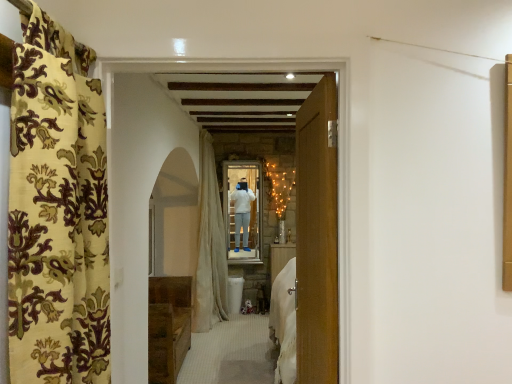
I want to click on white sheer curtain at center, marked as the second curtain in a front-to-back arrangement, so click(x=209, y=246).

You are a GUI agent. You are given a task and a screenshot of the screen. Output one action in this format:
    pyautogui.click(x=<x>, y=<y>)
    Task: Click on the white sheer curtain at center, the first curtain in the back-to-front sequence
    This screenshot has height=384, width=512.
    Given the screenshot: What is the action you would take?
    pyautogui.click(x=209, y=246)

Between velvet floral curtain at left, which ranks as the 1th curtain in front-to-back order, and white sheer curtain at center, marked as the second curtain in a front-to-back arrangement, which one has larger width?

white sheer curtain at center, marked as the second curtain in a front-to-back arrangement, is wider.

From the image's perspective, between velvet floral curtain at left, the second curtain viewed from the back, and white sheer curtain at center, marked as the second curtain in a front-to-back arrangement, which one is located above?

velvet floral curtain at left, the second curtain viewed from the back.

Which of these two, velvet floral curtain at left, which ranks as the 1th curtain in front-to-back order, or white sheer curtain at center, marked as the second curtain in a front-to-back arrangement, stands taller?

white sheer curtain at center, marked as the second curtain in a front-to-back arrangement.

Looking at this image, is velvet floral curtain at left, which ranks as the 1th curtain in front-to-back order, with white sheer curtain at center, the first curtain in the back-to-front sequence?

No, velvet floral curtain at left, which ranks as the 1th curtain in front-to-back order, is not making contact with white sheer curtain at center, the first curtain in the back-to-front sequence.

Considering the sizes of objects brown wooden chest at lower left and wooden door at center in the image provided, who is shorter, brown wooden chest at lower left or wooden door at center?

With less height is brown wooden chest at lower left.

Looking at the image, does brown wooden chest at lower left seem bigger or smaller compared to wooden door at center?

brown wooden chest at lower left is bigger than wooden door at center.

From the image's perspective, who appears lower, brown wooden chest at lower left or wooden door at center?

brown wooden chest at lower left, from the image's perspective.

How many degrees apart are the facing directions of wooden door at center and brown wooden chest at lower left?

87.3 degrees separate the facing orientations of wooden door at center and brown wooden chest at lower left.

Is wooden door at center further to camera compared to brown wooden chest at lower left?

No, wooden door at center is closer to the viewer.

Is wooden door at center to the left of brown wooden chest at lower left from the viewer's perspective?

Incorrect, wooden door at center is not on the left side of brown wooden chest at lower left.

From the image's perspective, relative to brown wooden chest at lower left, is wooden door at center above or below?

wooden door at center is situated higher than brown wooden chest at lower left in the image.

Could you measure the distance between white sheer curtain at center, marked as the second curtain in a front-to-back arrangement, and brown wooden chest at lower left?

They are 30.35 inches apart.

From the picture: Considering the relative positions of white sheer curtain at center, the first curtain in the back-to-front sequence, and brown wooden chest at lower left in the image provided, is white sheer curtain at center, the first curtain in the back-to-front sequence, to the right of brown wooden chest at lower left from the viewer's perspective?

Correct, you'll find white sheer curtain at center, the first curtain in the back-to-front sequence, to the right of brown wooden chest at lower left.

From a real-world perspective, which object rests below the other?

brown wooden chest at lower left, from a real-world perspective.

From the image's perspective, would you say white sheer curtain at center, the first curtain in the back-to-front sequence, is positioned over brown wooden chest at lower left?

Yes, from the image's perspective, white sheer curtain at center, the first curtain in the back-to-front sequence, is over brown wooden chest at lower left.

Is white sheer curtain at center, the first curtain in the back-to-front sequence, inside or outside of wooden door at center?

white sheer curtain at center, the first curtain in the back-to-front sequence, is not enclosed by wooden door at center.

Considering the relative sizes of white sheer curtain at center, the first curtain in the back-to-front sequence, and wooden door at center in the image provided, is white sheer curtain at center, the first curtain in the back-to-front sequence, bigger than wooden door at center?

Yes.

Is white sheer curtain at center, marked as the second curtain in a front-to-back arrangement, next to wooden door at center and touching it?

No, white sheer curtain at center, marked as the second curtain in a front-to-back arrangement, is not with wooden door at center.

Does point (203, 216) come farther from viewer compared to point (122, 247)?

That is True.

From the image's perspective, which one is positioned higher, velvet floral curtain at left, which ranks as the 1th curtain in front-to-back order, or wooden door at center?

From the image's view, wooden door at center is above.

Which is more to the left, velvet floral curtain at left, the second curtain viewed from the back, or wooden door at center?

Positioned to the left is velvet floral curtain at left, the second curtain viewed from the back.

Between velvet floral curtain at left, the second curtain viewed from the back, and wooden door at center, which one has larger size?

With larger size is wooden door at center.

From the picture: Can you tell me how much velvet floral curtain at left, which ranks as the 1th curtain in front-to-back order, and wooden door at center differ in facing direction?

They differ by 91.7 degrees in their facing directions.

Is wooden door at center facing away from velvet floral curtain at left, which ranks as the 1th curtain in front-to-back order?

Correct, wooden door at center is looking away from velvet floral curtain at left, which ranks as the 1th curtain in front-to-back order.

Does wooden door at center have a greater width compared to velvet floral curtain at left, the second curtain viewed from the back?

No, wooden door at center is not wider than velvet floral curtain at left, the second curtain viewed from the back.

Is wooden door at center far away from velvet floral curtain at left, the second curtain viewed from the back?

That's not correct — wooden door at center is a little close to velvet floral curtain at left, the second curtain viewed from the back.

Where is `curtain above the white sheer curtain at center, marked as the second curtain in a front-to-back arrangement (from the image's perspective)`? The height and width of the screenshot is (384, 512). curtain above the white sheer curtain at center, marked as the second curtain in a front-to-back arrangement (from the image's perspective) is located at coordinates (57, 211).

The image size is (512, 384). There is a brown wooden chest at lower left. Identify the location of hotel lobby above it (from a real-world perspective). (167, 178).

When comparing their distances from white sheer curtain at center, the first curtain in the back-to-front sequence, does velvet floral curtain at left, the second curtain viewed from the back, or brown wooden chest at lower left seem closer?

brown wooden chest at lower left is closer to white sheer curtain at center, the first curtain in the back-to-front sequence.

In the scene shown: When comparing their distances from brown wooden chest at lower left, does wooden door at center or white sheer curtain at center, marked as the second curtain in a front-to-back arrangement, seem further?

wooden door at center.

Based on their spatial positions, is brown wooden chest at lower left or velvet floral curtain at left, the second curtain viewed from the back, closer to wooden door at center?

velvet floral curtain at left, the second curtain viewed from the back, lies closer to wooden door at center than the other object.

Based on their spatial positions, is wooden door at center or velvet floral curtain at left, which ranks as the 1th curtain in front-to-back order, further from brown wooden chest at lower left?

The object further to brown wooden chest at lower left is velvet floral curtain at left, which ranks as the 1th curtain in front-to-back order.

Looking at this image, which object lies further to the anchor point white sheer curtain at center, the first curtain in the back-to-front sequence, velvet floral curtain at left, the second curtain viewed from the back, or wooden door at center?

Among the two, velvet floral curtain at left, the second curtain viewed from the back, is located further to white sheer curtain at center, the first curtain in the back-to-front sequence.

Looking at the image, which one is located further to wooden door at center, white sheer curtain at center, the first curtain in the back-to-front sequence, or brown wooden chest at lower left?

Based on the image, white sheer curtain at center, the first curtain in the back-to-front sequence, appears to be further to wooden door at center.

From the image, which object appears to be nearer to velvet floral curtain at left, which ranks as the 1th curtain in front-to-back order, white sheer curtain at center, the first curtain in the back-to-front sequence, or wooden door at center?

wooden door at center is positioned closer to the anchor velvet floral curtain at left, which ranks as the 1th curtain in front-to-back order.

In the scene shown: Based on their spatial positions, is wooden door at center or white sheer curtain at center, marked as the second curtain in a front-to-back arrangement, closer to velvet floral curtain at left, which ranks as the 1th curtain in front-to-back order?

Among the two, wooden door at center is located nearer to velvet floral curtain at left, which ranks as the 1th curtain in front-to-back order.

Locate an element on the screen. The image size is (512, 384). hotel lobby between velvet floral curtain at left, which ranks as the 1th curtain in front-to-back order, and white sheer curtain at center, marked as the second curtain in a front-to-back arrangement, from front to back is located at coordinates (167, 178).

Locate an element on the screen. The height and width of the screenshot is (384, 512). furniture between velvet floral curtain at left, the second curtain viewed from the back, and white sheer curtain at center, the first curtain in the back-to-front sequence, in the front-back direction is located at coordinates (168, 327).

Find the location of a particular element. hotel lobby between velvet floral curtain at left, the second curtain viewed from the back, and brown wooden chest at lower left in the front-back direction is located at coordinates (167, 178).

Locate an element on the screen. furniture between wooden door at center and white sheer curtain at center, marked as the second curtain in a front-to-back arrangement, along the z-axis is located at coordinates (168, 327).